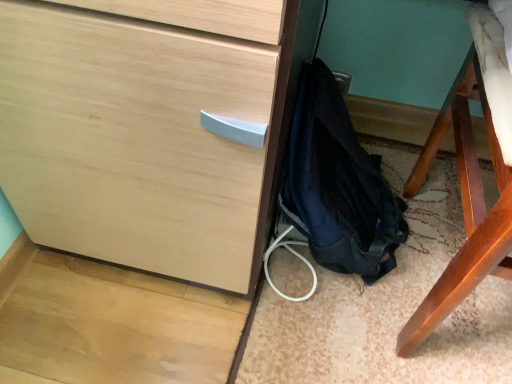
Where is `dark blue fabric backpack at lower right`? The width and height of the screenshot is (512, 384). dark blue fabric backpack at lower right is located at coordinates (338, 185).

The width and height of the screenshot is (512, 384). Describe the element at coordinates (338, 185) in the screenshot. I see `dark blue fabric backpack at lower right` at that location.

Describe the element at coordinates (149, 127) in the screenshot. The height and width of the screenshot is (384, 512). I see `matte wood chest of drawers at center` at that location.

Where is `matte wood chest of drawers at center`? This screenshot has height=384, width=512. matte wood chest of drawers at center is located at coordinates (149, 127).

From the picture: What is the approximate width of matte wood chest of drawers at center?

It is 27.42 inches.

Where is `dark blue fabric backpack at lower right`? dark blue fabric backpack at lower right is located at coordinates (338, 185).

Between matte wood chest of drawers at center and dark blue fabric backpack at lower right, which one appears on the left side from the viewer's perspective?

dark blue fabric backpack at lower right.

Who is more distant, matte wood chest of drawers at center or dark blue fabric backpack at lower right?

dark blue fabric backpack at lower right is more distant.

Is point (192, 187) closer or farther from the camera than point (340, 254)?

Point (192, 187) is positioned closer to the camera compared to point (340, 254).

From the image's perspective, is matte wood chest of drawers at center on top of dark blue fabric backpack at lower right?

Yes, from the image's perspective, matte wood chest of drawers at center is above dark blue fabric backpack at lower right.

From a real-world perspective, relative to dark blue fabric backpack at lower right, is matte wood chest of drawers at center vertically above or below?

In terms of real-world spatial position, matte wood chest of drawers at center is above dark blue fabric backpack at lower right.

Which of these two, matte wood chest of drawers at center or dark blue fabric backpack at lower right, is wider?

matte wood chest of drawers at center is wider.

In the scene shown: Considering the relative sizes of matte wood chest of drawers at center and dark blue fabric backpack at lower right in the image provided, is matte wood chest of drawers at center taller than dark blue fabric backpack at lower right?

Yes.

Who is bigger, matte wood chest of drawers at center or dark blue fabric backpack at lower right?

With larger size is matte wood chest of drawers at center.

Is matte wood chest of drawers at center outside of dark blue fabric backpack at lower right?

Yes, matte wood chest of drawers at center is located beyond the bounds of dark blue fabric backpack at lower right.

Is the surface of matte wood chest of drawers at center in direct contact with dark blue fabric backpack at lower right?

They are not placed beside each other.

Is matte wood chest of drawers at center facing away from dark blue fabric backpack at lower right?

No, dark blue fabric backpack at lower right is not at the back of matte wood chest of drawers at center.

Locate an element on the screen. Image resolution: width=512 pixels, height=384 pixels. backpack directly beneath the matte wood chest of drawers at center (from a real-world perspective) is located at coordinates (338, 185).

In the image, is dark blue fabric backpack at lower right on the left side or the right side of matte wood chest of drawers at center?

Based on their positions, dark blue fabric backpack at lower right is located to the left of matte wood chest of drawers at center.

Which object is closer to the camera, dark blue fabric backpack at lower right or matte wood chest of drawers at center?

matte wood chest of drawers at center.

Which is in front, point (336, 138) or point (109, 209)?

The point (109, 209) is in front.

From the image's perspective, which is above, dark blue fabric backpack at lower right or matte wood chest of drawers at center?

matte wood chest of drawers at center is shown above in the image.

From a real-world perspective, between dark blue fabric backpack at lower right and matte wood chest of drawers at center, who is vertically higher?

From a 3D spatial view, matte wood chest of drawers at center is above.

In the scene shown: Looking at their sizes, would you say dark blue fabric backpack at lower right is wider or thinner than matte wood chest of drawers at center?

Considering their sizes, dark blue fabric backpack at lower right looks slimmer than matte wood chest of drawers at center.

In the scene shown: Which of these two, dark blue fabric backpack at lower right or matte wood chest of drawers at center, stands shorter?

dark blue fabric backpack at lower right.

Who is bigger, dark blue fabric backpack at lower right or matte wood chest of drawers at center?

matte wood chest of drawers at center is bigger.

Is dark blue fabric backpack at lower right inside or outside of matte wood chest of drawers at center?

dark blue fabric backpack at lower right is inside matte wood chest of drawers at center.

Would you say dark blue fabric backpack at lower right is a long distance from matte wood chest of drawers at center?

No, dark blue fabric backpack at lower right is in close proximity to matte wood chest of drawers at center.

Based on the photo, is matte wood chest of drawers at center at the back of dark blue fabric backpack at lower right?

Correct, dark blue fabric backpack at lower right is looking away from matte wood chest of drawers at center.

How different are the orientations of dark blue fabric backpack at lower right and matte wood chest of drawers at center in degrees?

176 degrees separate the facing orientations of dark blue fabric backpack at lower right and matte wood chest of drawers at center.

You are a GUI agent. You are given a task and a screenshot of the screen. Output one action in this format:
    pyautogui.click(x=<x>, y=<y>)
    Task: Click on the chest of drawers in front of the dark blue fabric backpack at lower right
    The height and width of the screenshot is (384, 512).
    Given the screenshot: What is the action you would take?
    pyautogui.click(x=149, y=127)

Locate an element on the screen. The image size is (512, 384). the chest of drawers positioned vertically above the dark blue fabric backpack at lower right (from a real-world perspective) is located at coordinates (149, 127).

The image size is (512, 384). Identify the location of backpack that is under the matte wood chest of drawers at center (from a real-world perspective). pyautogui.click(x=338, y=185).